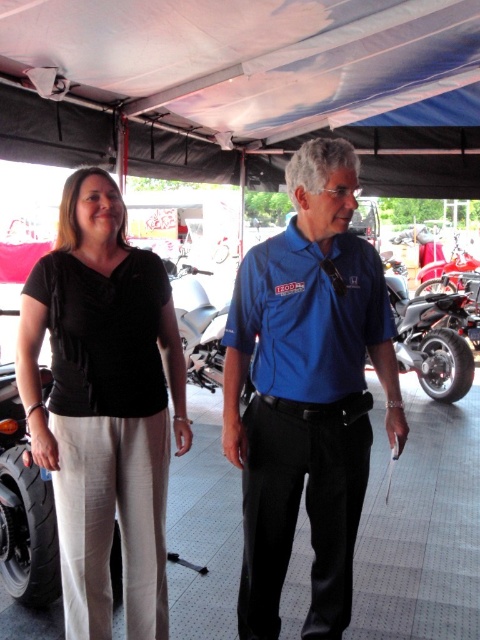
You are a photographer setting up a shot at a motorcycle exhibition. You need to ensure that the blue shirt at center and the black fabric shirt at left are both fully visible in the frame. Based on their positions and sizes, which shirt should you prioritize keeping centered to avoid cropping either?

The blue shirt at center might be wider than black fabric shirt at left, so you should prioritize keeping the blue shirt at center centered to ensure both shirts are fully visible without cropping.